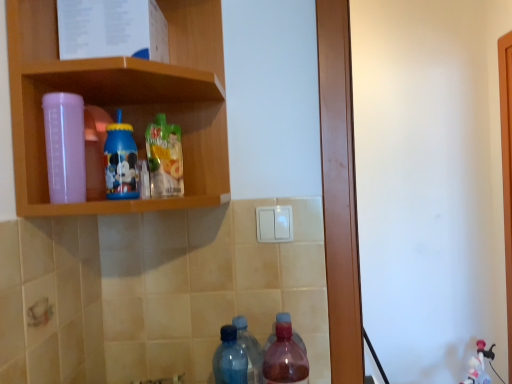
Question: From a real-world perspective, is translucent pink bottle at lower center, acting as the 5th bottle starting from the left, above or below transparent plastic bottle at upper left, marked as the 1th bottle in a left-to-right arrangement?

Choices:
 (A) above
 (B) below

Answer: (B)

Question: Based on their sizes in the image, would you say translucent pink bottle at lower center, acting as the 5th bottle starting from the left, is bigger or smaller than transparent plastic bottle at upper left, which appears as the fifth bottle when viewed from the right?

Choices:
 (A) big
 (B) small

Answer: (A)

Question: Which object is the farthest from the translucent plastic juice at center, the 3th bottle viewed from the right?

Choices:
 (A) pink plastic cup at upper left
 (B) translucent pink bottle at lower center, acting as the 5th bottle starting from the left
 (C) blue plastic cup at upper center, positioned as the second bottle in left-to-right order
 (D) transparent plastic bottle at upper left, which appears as the fifth bottle when viewed from the right
 (E) blue translucent bottle at lower center, acting as the second bottle starting from the right

Answer: (B)

Question: Which object is positioned closest to the blue plastic cup at upper center, which ranks as the 4th bottle in right-to-left order?

Choices:
 (A) pink plastic cup at upper left
 (B) blue translucent bottle at lower center, acting as the second bottle starting from the right
 (C) translucent plastic juice at center, the 3th bottle viewed from the right
 (D) translucent pink bottle at lower center, the 1th bottle from the right
 (E) transparent plastic bottle at upper left, marked as the 1th bottle in a left-to-right arrangement

Answer: (C)